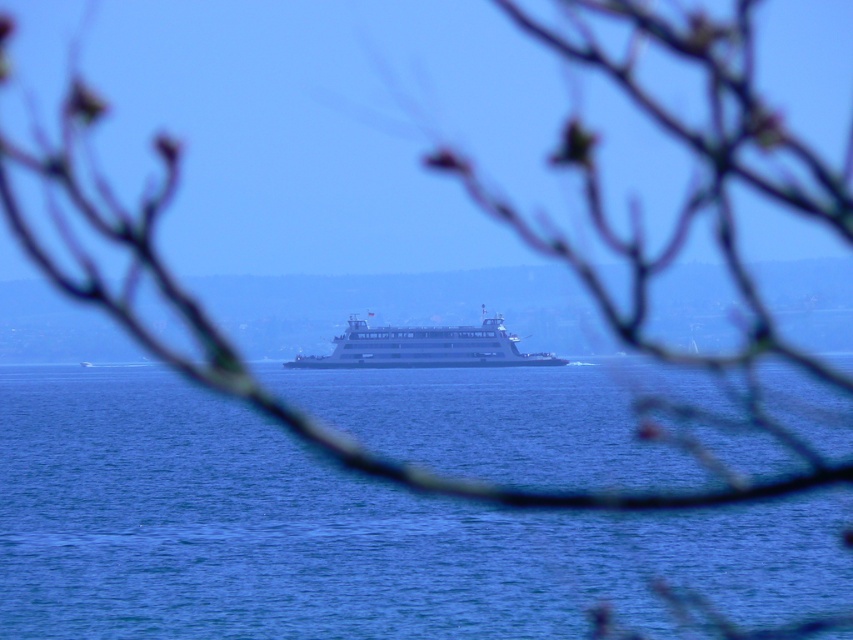
You are standing on the ferry boat and looking at two points in the scene. The first point is at coordinates point (822,396) and the second is at point (476,349). Which point is closer to you?

Point (822,396) is closer to the viewer than point (476,349).

You are a photographer positioned at the tree branches in the foreground. You want to capture a photo where the white glossy ferry at center is to the right of the blue water at center. Is this possible based on the scene?

The blue water at center is positioned on the left side of white glossy ferry at center, so yes, the white glossy ferry at center will naturally appear to the right of the blue water at center in the photo.